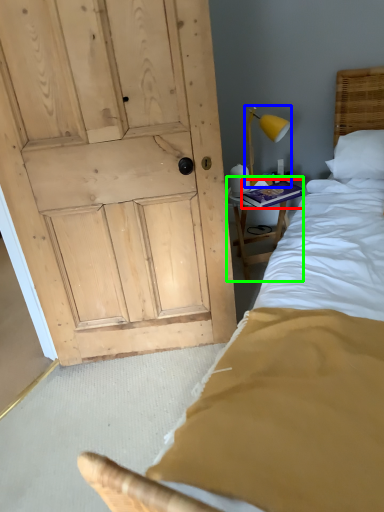
Question: Which object is positioned farthest from book (highlighted by a red box)? Select from bedside lamp (highlighted by a blue box) and furniture (highlighted by a green box).

Choices:
 (A) bedside lamp
 (B) furniture

Answer: (A)